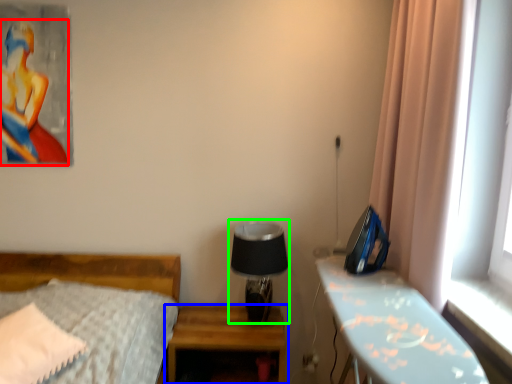
Question: Which object is positioned closest to woman (highlighted by a red box)? Select from nightstand (highlighted by a blue box) and table lamp (highlighted by a green box).

Choices:
 (A) nightstand
 (B) table lamp

Answer: (B)